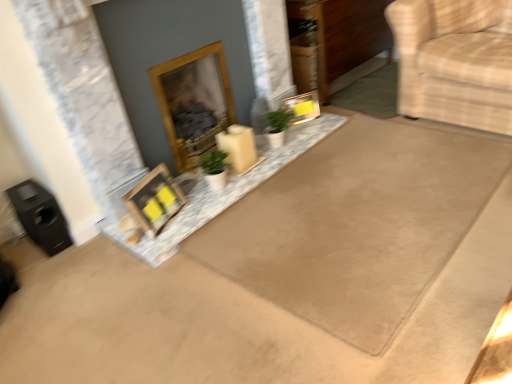
Question: Is wooden fireplace at center inside or outside of wooden picture frame at center, which appears as the 1th picture frame when viewed from the left?

Choices:
 (A) inside
 (B) outside

Answer: (B)

Question: From their relative heights in the image, would you say wooden fireplace at center is taller or shorter than wooden picture frame at center, acting as the 2th picture frame starting from the right?

Choices:
 (A) short
 (B) tall

Answer: (B)

Question: Based on their relative distances, which object is nearer to the wooden picture frame at center, which appears as the second picture frame when viewed from the top?

Choices:
 (A) matte gold picture frame at center, the 2th picture frame positioned from the front
 (B) white marble tray at center
 (C) beige fabric armchair at right
 (D) beige carpet at center, marked as the first doormat in a left-to-right arrangement
 (E) wooden fireplace at center

Answer: (B)

Question: Which object is the farthest from the beige carpet at upper right, which is the 2th doormat in left-to-right order?

Choices:
 (A) wooden picture frame at center, which is the 1th picture frame in bottom-to-top order
 (B) white marble tray at center
 (C) wooden fireplace at center
 (D) beige carpet at center, acting as the second doormat starting from the right
 (E) beige fabric armchair at right

Answer: (A)